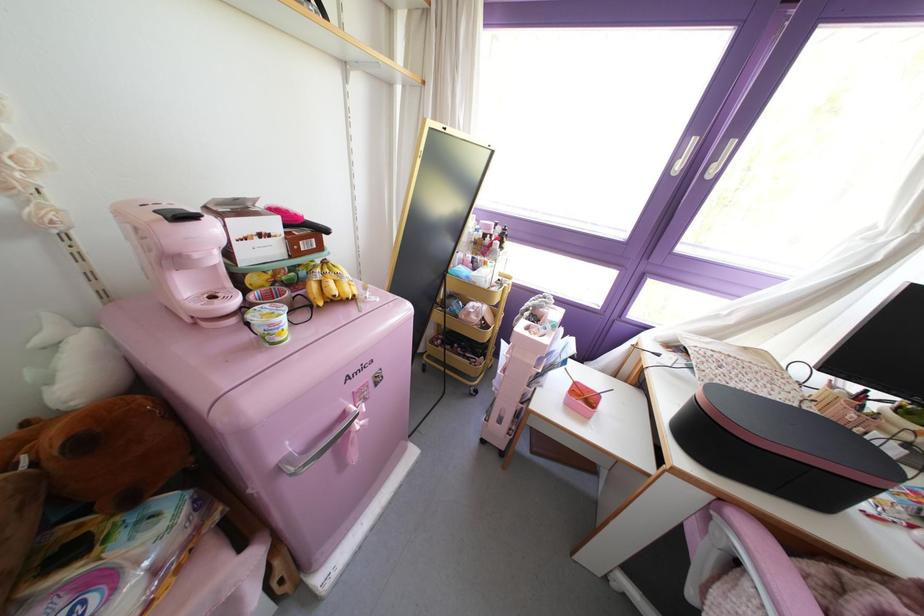
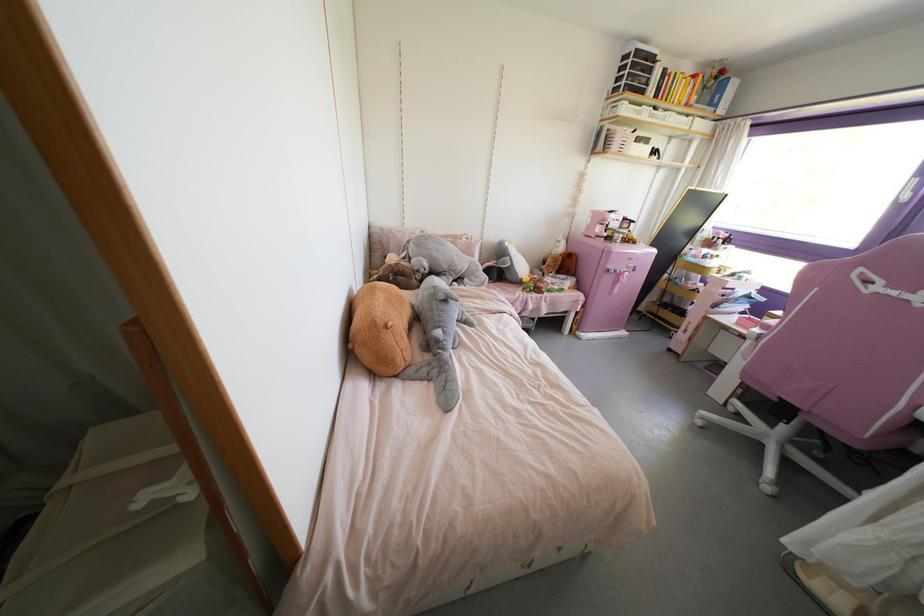
The point at (375, 384) is marked in the first image. Where is the corresponding point in the second image?

(633, 270)